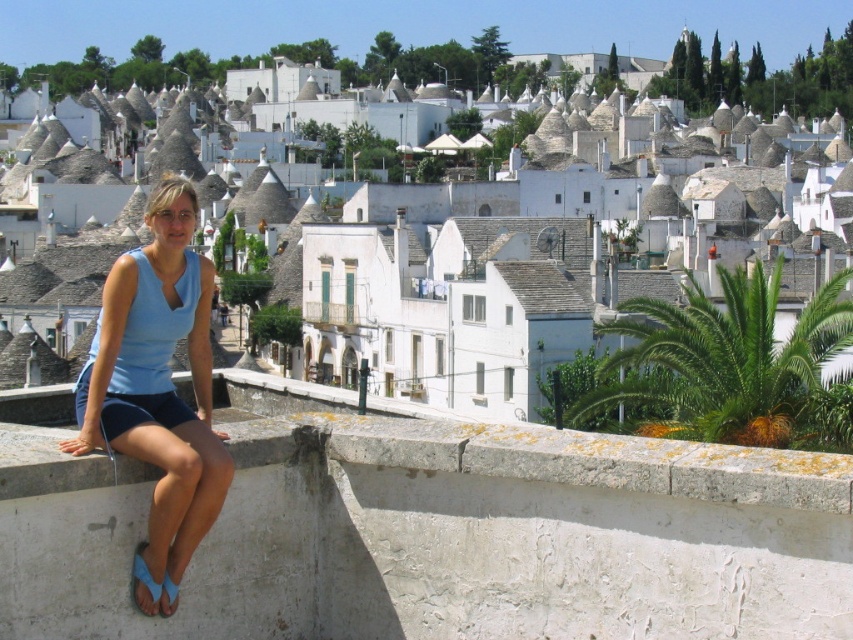
Which is above, white stone buildings at center or blue fabric shorts at lower left?

white stone buildings at center

Does white stone buildings at center have a greater height compared to blue fabric shorts at lower left?

Yes, white stone buildings at center is taller than blue fabric shorts at lower left.

Find the location of a particular element. white stone buildings at center is located at coordinates (552, 244).

What are the coordinates of `white stone buildings at center` in the screenshot? It's located at (552, 244).